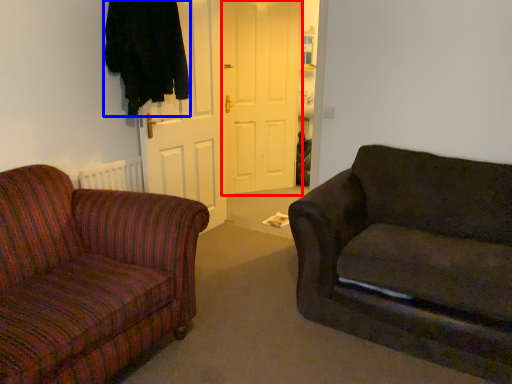
Question: Among these objects, which one is nearest to the camera, door (highlighted by a red box) or clothing (highlighted by a blue box)?

Choices:
 (A) door
 (B) clothing

Answer: (B)